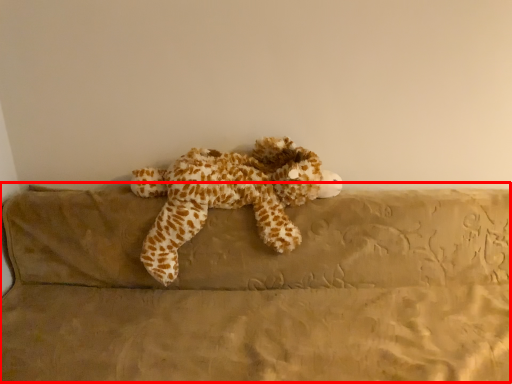
Question: In this image, where is couch (annotated by the red box) located relative to toy?

Choices:
 (A) right
 (B) left

Answer: (A)